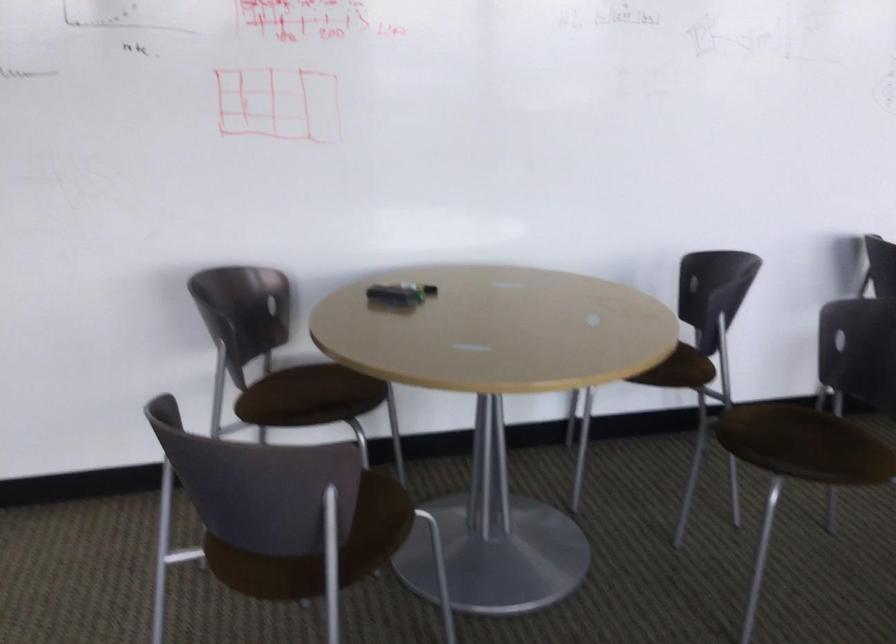
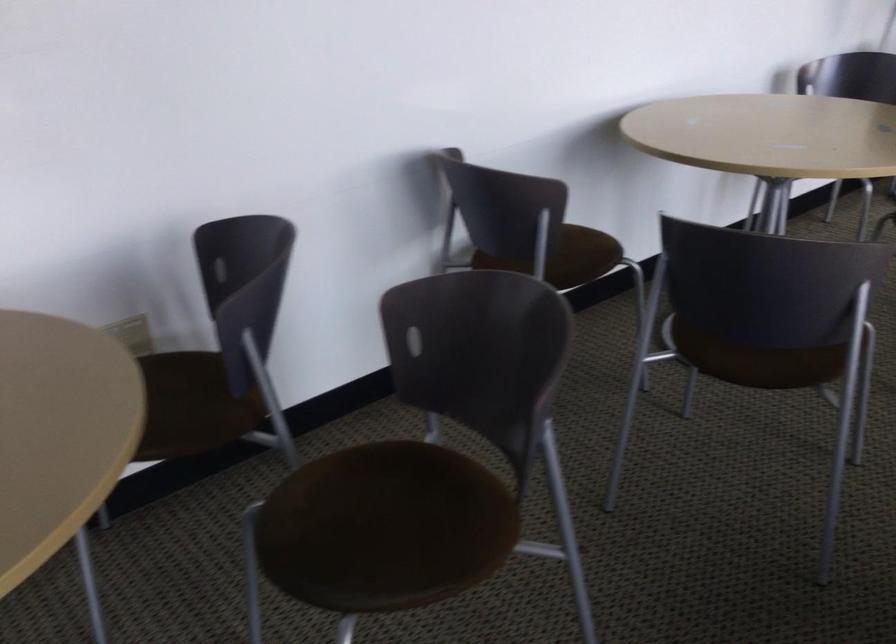
What movement of the cameraman would produce the second image?

The cameraman moved toward right, forward.